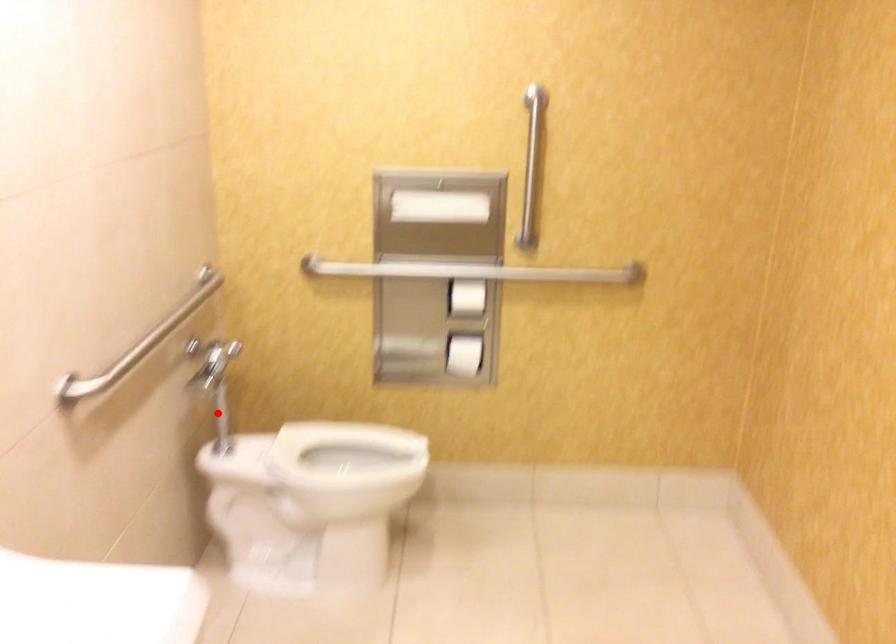
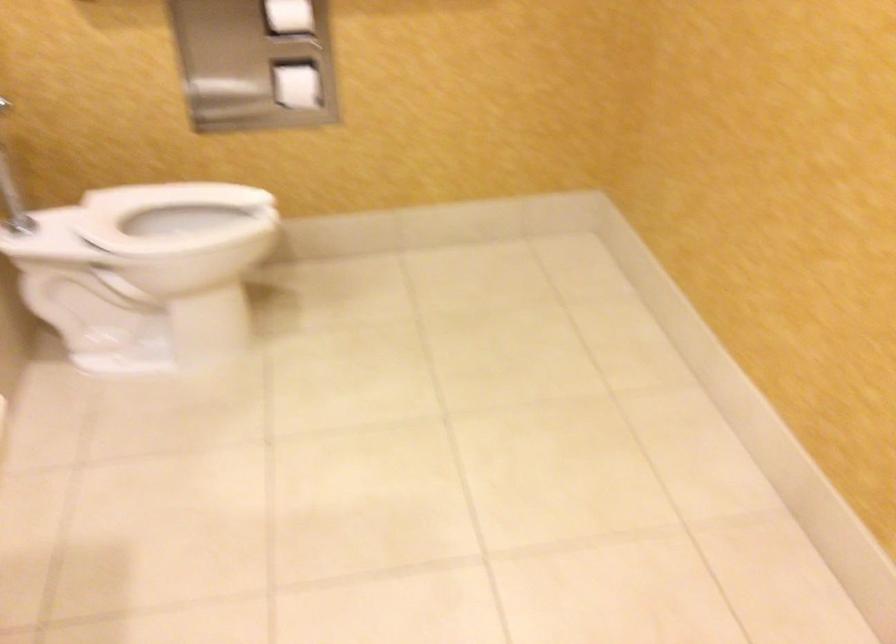
Where in the second image is the point corresponding to the highlighted location from the first image?

(12, 191)